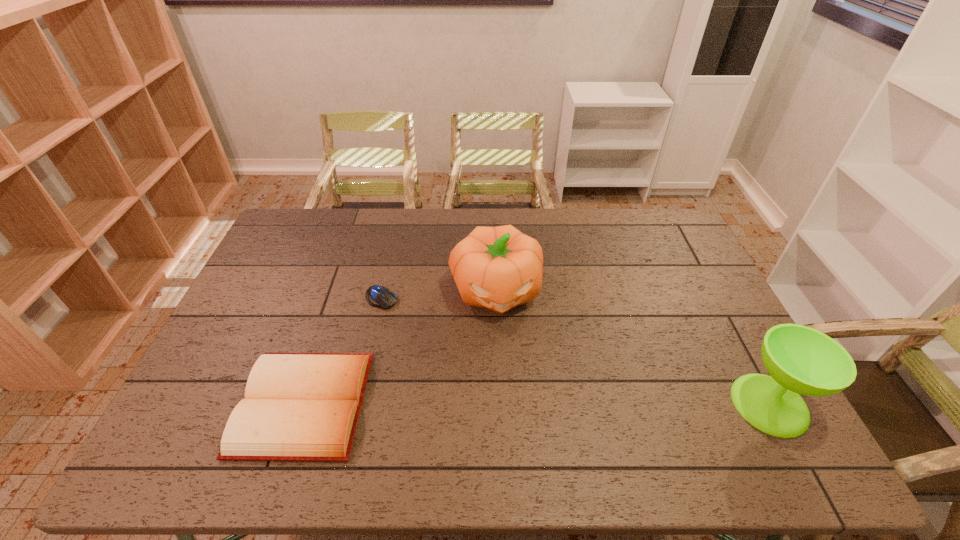
This screenshot has height=540, width=960. What are the coordinates of `free spot located on the carved face of the pumpkin` in the screenshot? It's located at (504, 343).

Where is `vacant space situated 0.250m on the carved face of the pumpkin`? The height and width of the screenshot is (540, 960). vacant space situated 0.250m on the carved face of the pumpkin is located at coordinates (513, 399).

This screenshot has width=960, height=540. Find the location of `Bible present at the near edge`. Bible present at the near edge is located at coordinates (298, 406).

The height and width of the screenshot is (540, 960). Find the location of `wineglass situated at the near edge`. wineglass situated at the near edge is located at coordinates (801, 360).

Locate an element on the screen. The width and height of the screenshot is (960, 540). object positioned at the left edge is located at coordinates (298, 406).

Where is `object situated at the right edge`? The image size is (960, 540). object situated at the right edge is located at coordinates (801, 360).

I want to click on object at the near left corner, so click(298, 406).

You are a GUI agent. You are given a task and a screenshot of the screen. Output one action in this format:
    pyautogui.click(x=<x>, y=<y>)
    Task: Click on the object situated at the near right corner
    The width and height of the screenshot is (960, 540).
    Given the screenshot: What is the action you would take?
    801,360

You are a GUI agent. You are given a task and a screenshot of the screen. Output one action in this format:
    pyautogui.click(x=<x>, y=<y>)
    Task: Click on the vacant point at the far edge
    This screenshot has width=960, height=540.
    Given the screenshot: What is the action you would take?
    pyautogui.click(x=634, y=237)

Identify the location of vacant space at the near edge. The width and height of the screenshot is (960, 540). (537, 395).